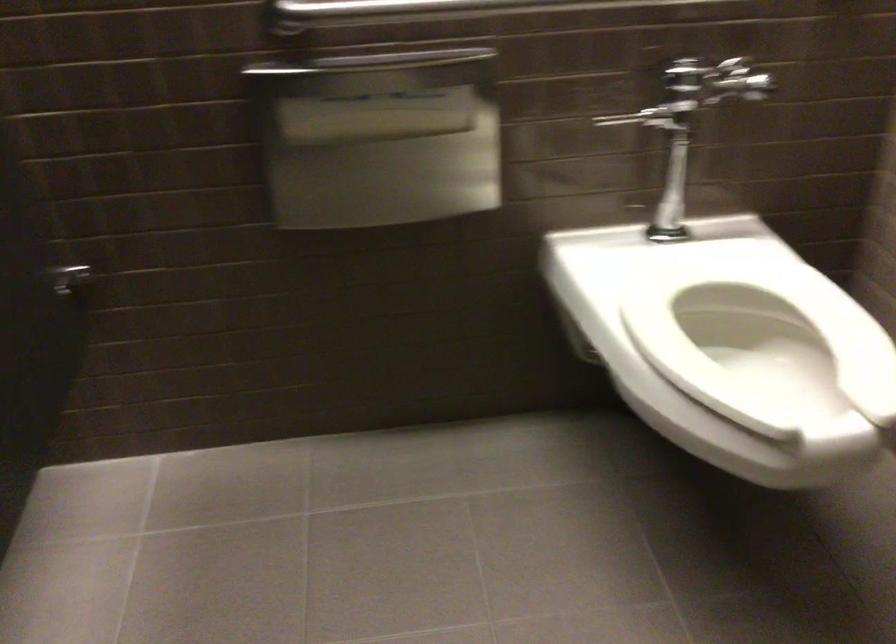
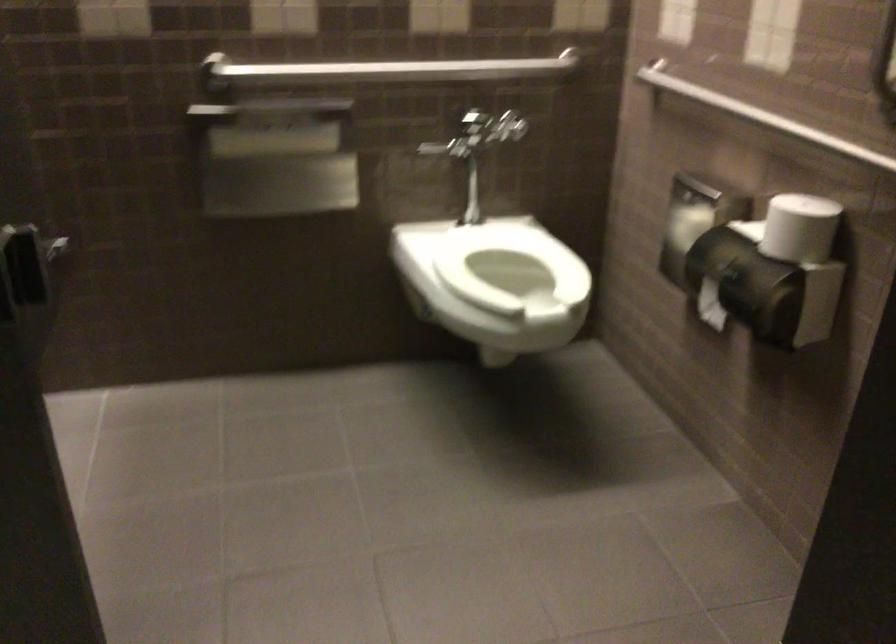
The point at (731, 303) is marked in the first image. Where is the corresponding point in the second image?

(509, 263)